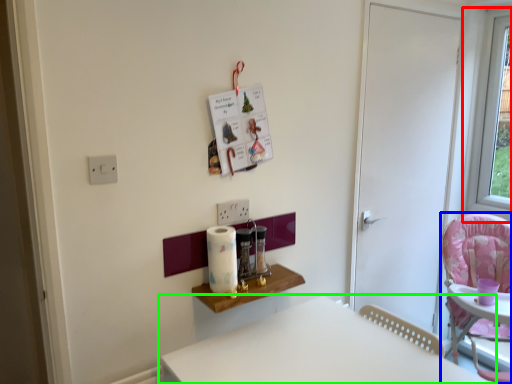
Question: Considering the real-world distances, which object is farthest from window (highlighted by a red box)? chair (highlighted by a blue box) or table (highlighted by a green box)?

Choices:
 (A) chair
 (B) table

Answer: (B)